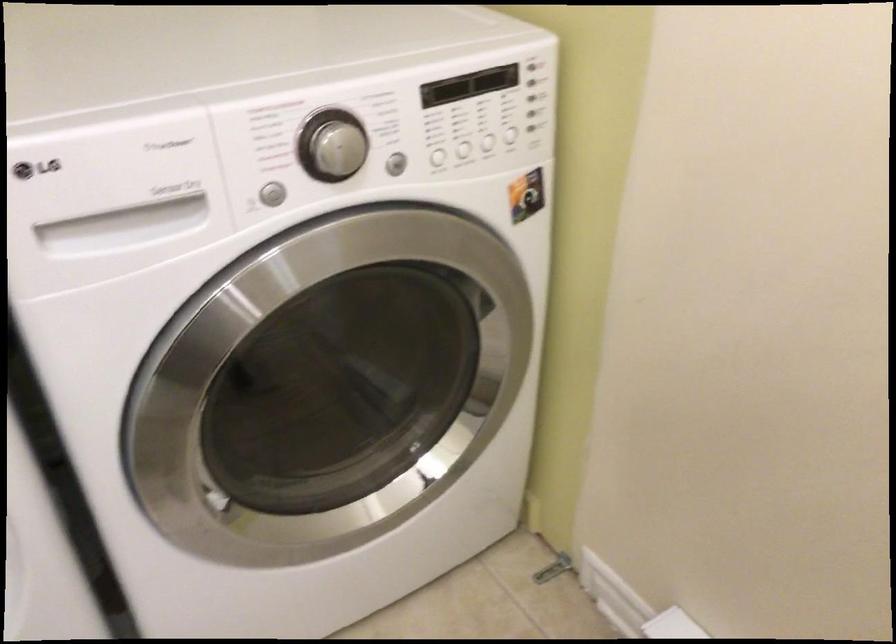
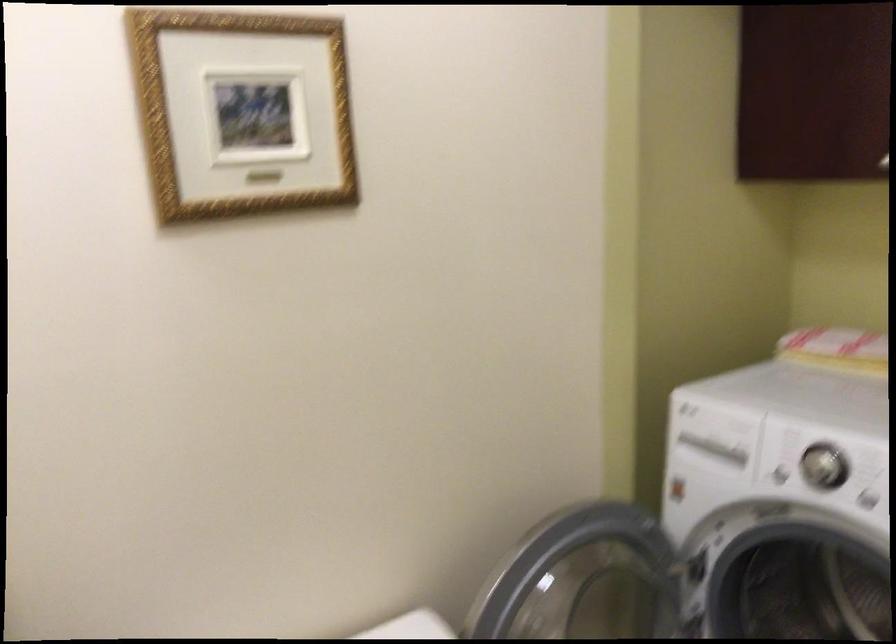
Question: The first image is from the beginning of the video and the second image is from the end. How did the camera likely rotate when shooting the video?

Choices:
 (A) Left
 (B) Right
 (C) Up
 (D) Down

Answer: (A)